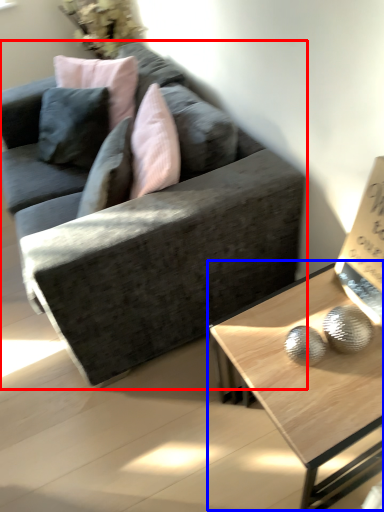
Question: Which of the following is the farthest to the observer, studio couch (highlighted by a red box) or coffee table (highlighted by a blue box)?

Choices:
 (A) studio couch
 (B) coffee table

Answer: (A)